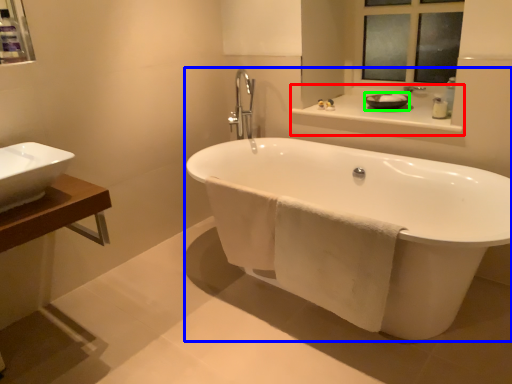
Question: Which object is positioned closest to counter top (highlighted by a red box)? Select from bathtub (highlighted by a blue box) and basin (highlighted by a green box).

Choices:
 (A) bathtub
 (B) basin

Answer: (B)